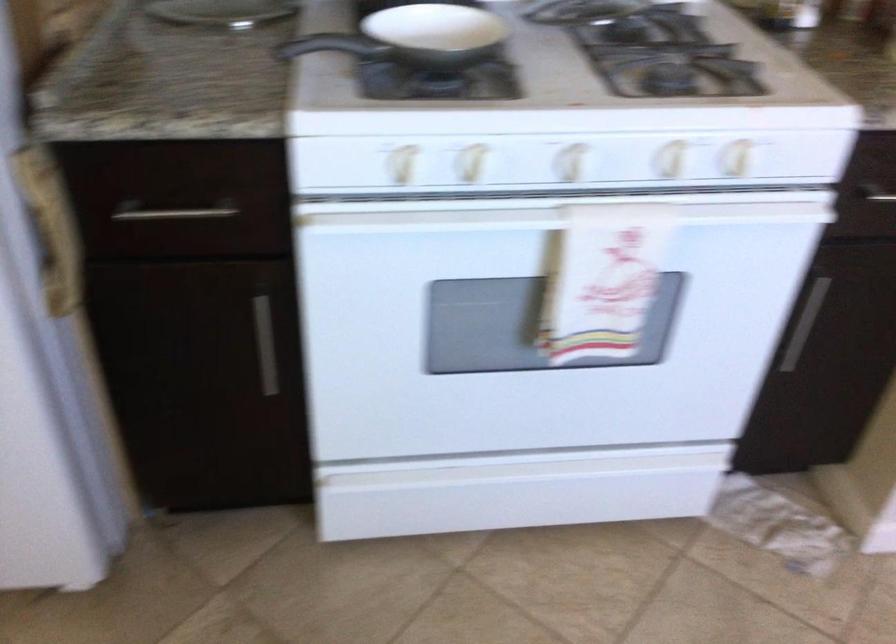
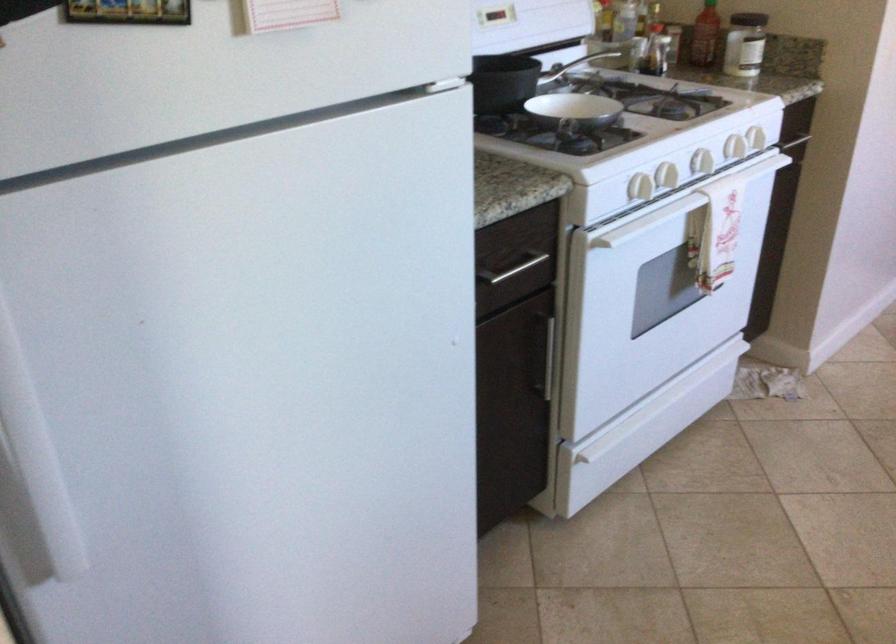
In the second image, find the point that corresponds to the point at 591,207 in the first image.

(734, 147)